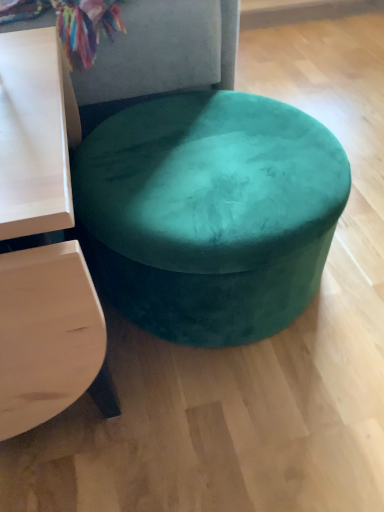
Locate an element on the screen. The width and height of the screenshot is (384, 512). vacant area that is situated to the right of matte white table at left is located at coordinates (262, 405).